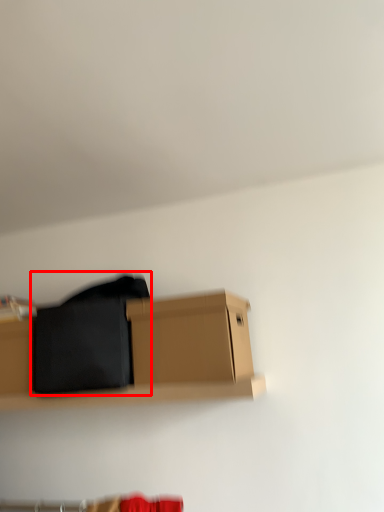
Question: From the image, what is the correct spatial relationship of clothing (annotated by the red box) in relation to box?

Choices:
 (A) right
 (B) left

Answer: (B)